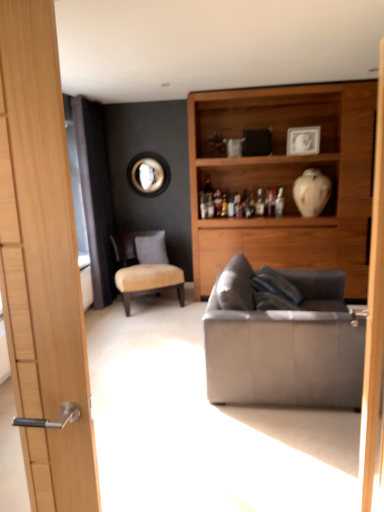
Question: Is white glossy vase at upper right behind wooden cabinet at upper right?

Choices:
 (A) yes
 (B) no

Answer: (A)

Question: From a real-world perspective, is white glossy vase at upper right over wooden cabinet at upper right?

Choices:
 (A) no
 (B) yes

Answer: (B)

Question: Can you confirm if white glossy vase at upper right is positioned to the left of wooden cabinet at upper right?

Choices:
 (A) no
 (B) yes

Answer: (A)

Question: Is the depth of white glossy vase at upper right less than that of wooden cabinet at upper right?

Choices:
 (A) no
 (B) yes

Answer: (A)

Question: From the image's perspective, would you say white glossy vase at upper right is shown under wooden cabinet at upper right?

Choices:
 (A) yes
 (B) no

Answer: (B)

Question: Is white glossy vase at upper right not near wooden cabinet at upper right?

Choices:
 (A) yes
 (B) no

Answer: (B)

Question: Can you confirm if black fabric screen door at left is shorter than white glossy vase at upper right?

Choices:
 (A) yes
 (B) no

Answer: (B)

Question: Can you confirm if black fabric screen door at left is thinner than white glossy vase at upper right?

Choices:
 (A) no
 (B) yes

Answer: (B)

Question: Considering the relative positions of black fabric screen door at left and white glossy vase at upper right in the image provided, is black fabric screen door at left to the right of white glossy vase at upper right from the viewer's perspective?

Choices:
 (A) yes
 (B) no

Answer: (B)

Question: Is black fabric screen door at left outside white glossy vase at upper right?

Choices:
 (A) no
 (B) yes

Answer: (B)

Question: Is black fabric screen door at left far from white glossy vase at upper right?

Choices:
 (A) yes
 (B) no

Answer: (A)

Question: From a real-world perspective, does black fabric screen door at left stand above white glossy vase at upper right?

Choices:
 (A) yes
 (B) no

Answer: (B)

Question: Is suede gray couch at right oriented towards white glossy vase at upper right?

Choices:
 (A) no
 (B) yes

Answer: (A)